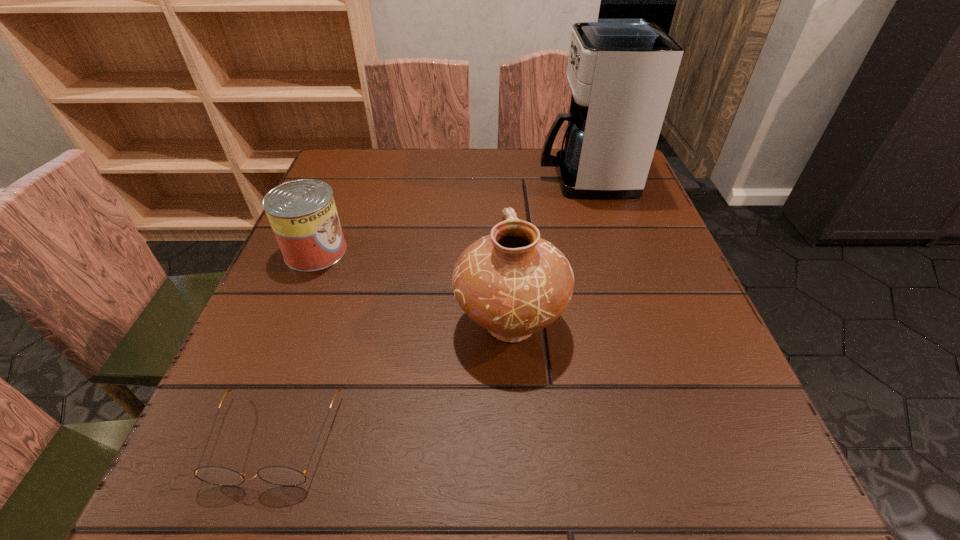
At what (x,y) coordinates should I click in order to perform the action: click on vacant space located 0.050m on the front panel of the farthest object. Please return your answer as a coordinate pair (x, y). Looking at the image, I should click on (519, 179).

Find the location of a particular element. This screenshot has width=960, height=540. vacant region located on the side of the second tallest object with the handle is located at coordinates (505, 253).

This screenshot has width=960, height=540. I want to click on vacant space located 0.370m on the side of the second tallest object with the handle, so pos(500,179).

You are a GUI agent. You are given a task and a screenshot of the screen. Output one action in this format:
    pyautogui.click(x=<x>, y=<y>)
    Task: Click on the vacant region located on the side of the second tallest object with the handle
    Image resolution: width=960 pixels, height=540 pixels.
    Given the screenshot: What is the action you would take?
    pyautogui.click(x=504, y=240)

Locate an element on the screen. This screenshot has height=540, width=960. free space located 0.090m on the right of the third nearest object is located at coordinates [x=391, y=252].

This screenshot has height=540, width=960. I want to click on object present at the far edge, so click(x=621, y=72).

Locate an element on the screen. Image resolution: width=960 pixels, height=540 pixels. object that is at the near edge is located at coordinates (278, 475).

Image resolution: width=960 pixels, height=540 pixels. In order to click on can that is at the left edge in this screenshot , I will do `click(302, 213)`.

Where is `spectacles present at the left edge`? This screenshot has width=960, height=540. spectacles present at the left edge is located at coordinates pyautogui.click(x=278, y=475).

You are a GUI agent. You are given a task and a screenshot of the screen. Output one action in this format:
    pyautogui.click(x=<x>, y=<y>)
    Task: Click on the object that is at the right edge
    
    Given the screenshot: What is the action you would take?
    pyautogui.click(x=621, y=72)